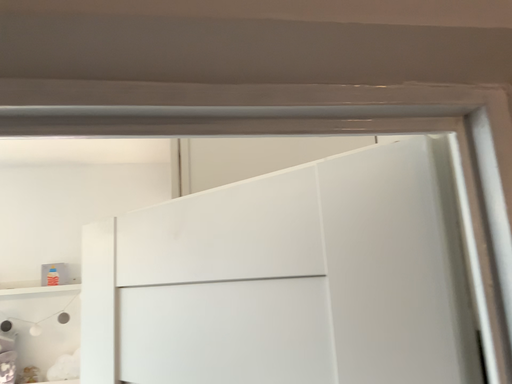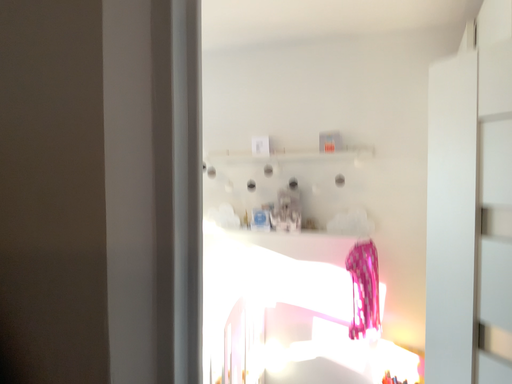
Question: Which way did the camera rotate in the video?

Choices:
 (A) rotated left
 (B) rotated right

Answer: (A)